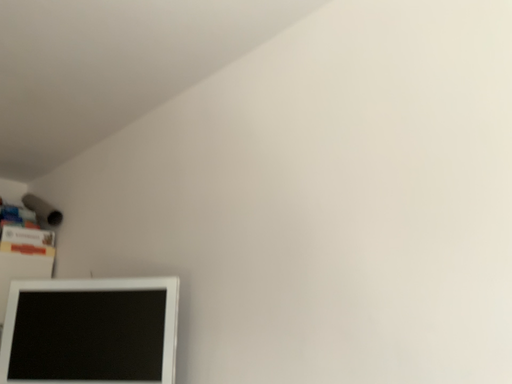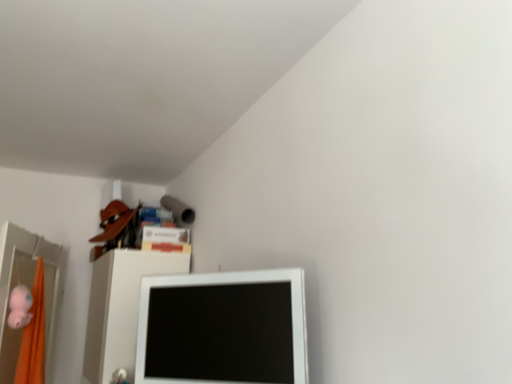
Question: Which way did the camera rotate in the video?

Choices:
 (A) rotated right
 (B) rotated left

Answer: (B)